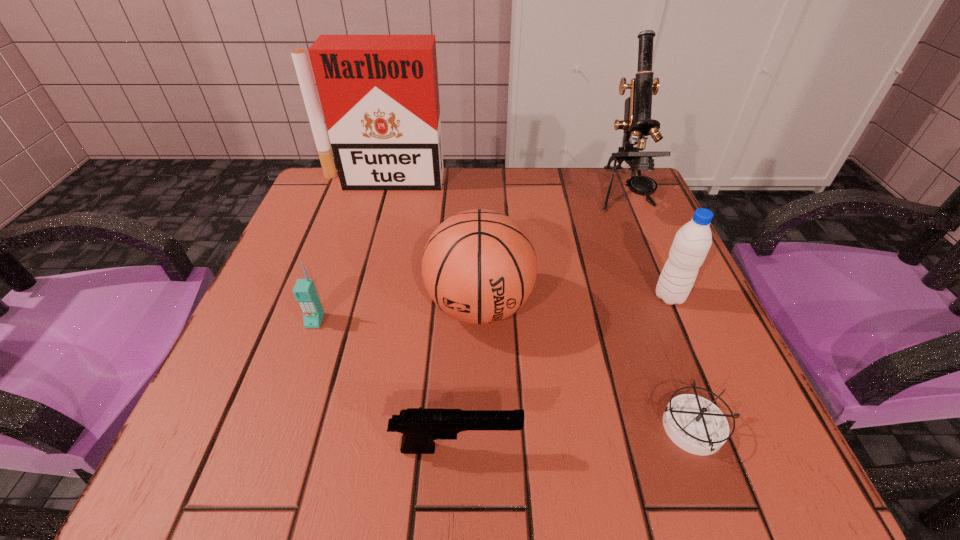
Select which object is the closest to the fifth tallest object. Please provide its 2D coordinates. Your answer should be formatted as a tuple, i.e. [(x, y)], where the tuple contains the x and y coordinates of a point satisfying the conditions above.

[(479, 266)]

Locate an element on the screen. vacant region that satisfies the following two spatial constraints: 1. on the surface of the basketball near the brand logo; 2. on the left side of the shortest object is located at coordinates (479, 429).

Locate an element on the screen. This screenshot has width=960, height=540. free spot that satisfies the following two spatial constraints: 1. on the front-facing side of the cigarette case; 2. on the right side of the water bottle is located at coordinates (348, 296).

Locate an element on the screen. Image resolution: width=960 pixels, height=540 pixels. vacant region that satisfies the following two spatial constraints: 1. on the front-facing side of the water bottle; 2. on the right side of the cigarette case is located at coordinates (348, 296).

Where is `free space that satisfies the following two spatial constraints: 1. through the eyepiece of the microscope; 2. on the front-facing side of the sixth tallest object`? The height and width of the screenshot is (540, 960). free space that satisfies the following two spatial constraints: 1. through the eyepiece of the microscope; 2. on the front-facing side of the sixth tallest object is located at coordinates (729, 448).

Find the location of a particular element. This screenshot has width=960, height=540. free space that satisfies the following two spatial constraints: 1. on the keypad of the cellular telephone; 2. on the left side of the shortest object is located at coordinates (277, 429).